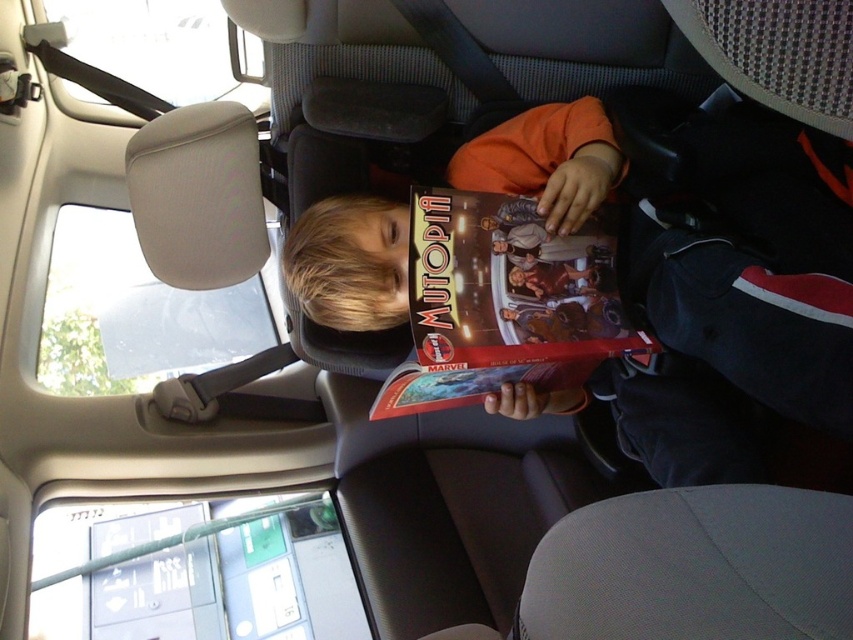
Question: Which object appears closest to the camera in this image?

Choices:
 (A) matte paper comic book at center
 (B) matte orange book at center

Answer: (B)

Question: Is matte orange book at center in front of matte paper comic book at center?

Choices:
 (A) yes
 (B) no

Answer: (A)

Question: From the image, what is the correct spatial relationship of matte orange book at center in relation to matte paper comic book at center?

Choices:
 (A) left
 (B) right

Answer: (B)

Question: Among these objects, which one is farthest from the camera?

Choices:
 (A) matte paper comic book at center
 (B) matte orange book at center

Answer: (A)

Question: Which object appears farthest from the camera in this image?

Choices:
 (A) matte orange book at center
 (B) matte paper comic book at center

Answer: (B)

Question: Is matte orange book at center wider than matte paper comic book at center?

Choices:
 (A) yes
 (B) no

Answer: (A)